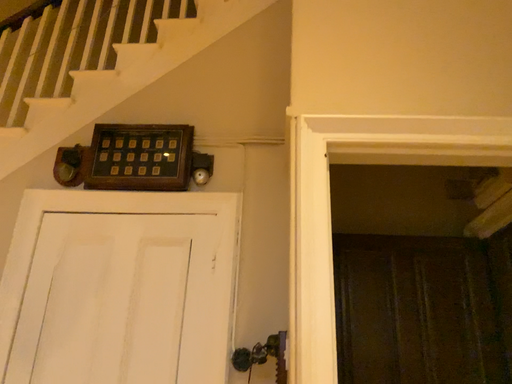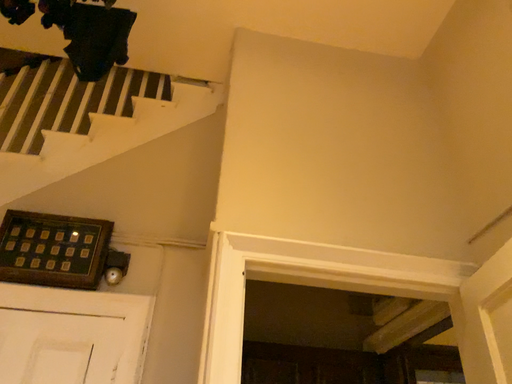
Question: How did the camera likely rotate when shooting the video?

Choices:
 (A) rotated downward
 (B) rotated upward

Answer: (B)